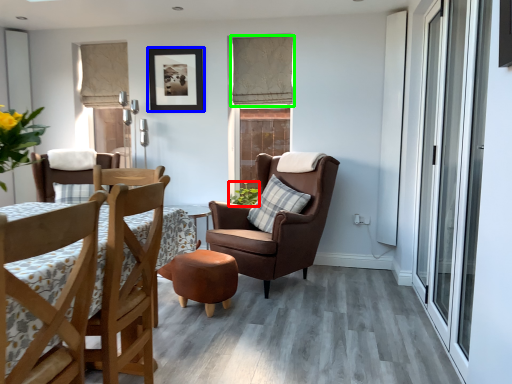
Question: Which object is positioned farthest from houseplant (highlighted by a red box)? Select from picture frame (highlighted by a blue box) and curtain (highlighted by a green box).

Choices:
 (A) picture frame
 (B) curtain

Answer: (A)